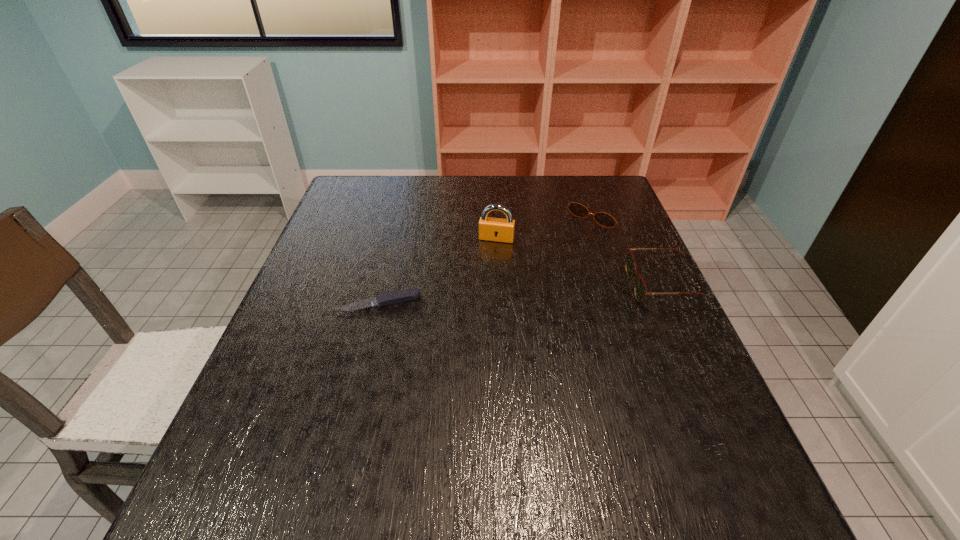
This screenshot has height=540, width=960. I want to click on blank space located at the front view of the second tallest object, so point(608,286).

At what (x,y) coordinates should I click in order to perform the action: click on vacant space situated on the face of the sunglasses. Please return your answer as a coordinate pair (x, y). The image size is (960, 540). Looking at the image, I should click on (507, 300).

The image size is (960, 540). Find the location of `vacant space positioned 0.170m on the face of the sunglasses`. vacant space positioned 0.170m on the face of the sunglasses is located at coordinates (554, 255).

This screenshot has height=540, width=960. What are the coordinates of `vacant space located 0.400m on the face of the sunglasses` in the screenshot? It's located at (504, 302).

The height and width of the screenshot is (540, 960). Find the location of `vacant space situated to unlock the tallest object from the front`. vacant space situated to unlock the tallest object from the front is located at coordinates pyautogui.click(x=488, y=266).

At what (x,y) coordinates should I click in order to perform the action: click on vacant space situated 0.230m to unlock the tallest object from the front. Please return your answer as a coordinate pair (x, y). Looking at the image, I should click on (479, 300).

You are a GUI agent. You are given a task and a screenshot of the screen. Output one action in this format:
    pyautogui.click(x=<x>, y=<y>)
    Task: Click on the free space located to unlock the tallest object from the front
    
    Given the screenshot: What is the action you would take?
    pyautogui.click(x=488, y=264)

Where is `object at the far edge`? This screenshot has height=540, width=960. object at the far edge is located at coordinates (577, 209).

In order to click on object that is at the left edge in this screenshot , I will do `click(395, 297)`.

The height and width of the screenshot is (540, 960). Identify the location of spectacles that is at the right edge. (640, 289).